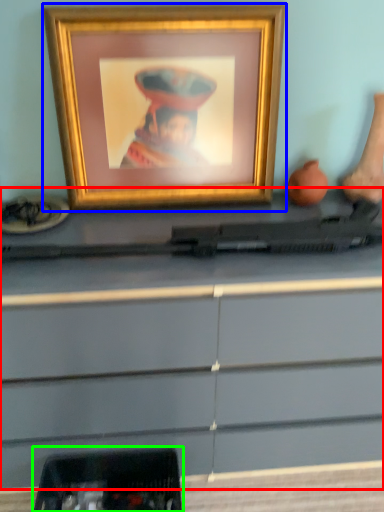
Question: Estimate the real-world distances between objects in this image. Which object is closer to desk (highlighted by a red box), picture frame (highlighted by a blue box) or equipment (highlighted by a green box)?

Choices:
 (A) picture frame
 (B) equipment

Answer: (B)